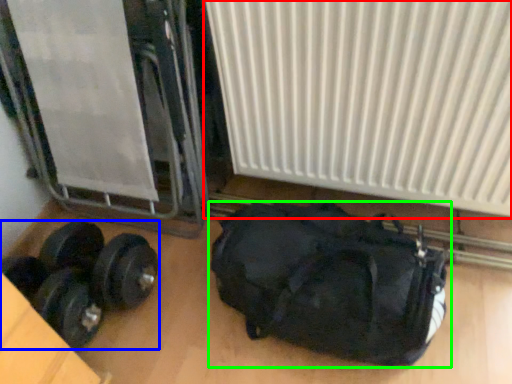
Question: Based on their relative distances, which object is nearer to radiator (highlighted by a red box)? Choose from dumbbell (highlighted by a blue box) and luggage and bags (highlighted by a green box).

Choices:
 (A) dumbbell
 (B) luggage and bags

Answer: (B)